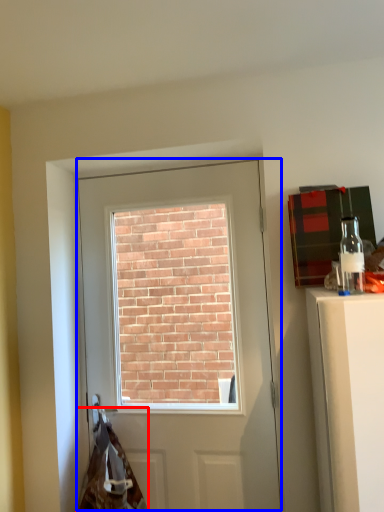
Question: Which object appears farthest to the camera in this image, material (highlighted by a red box) or door (highlighted by a blue box)?

Choices:
 (A) material
 (B) door

Answer: (B)